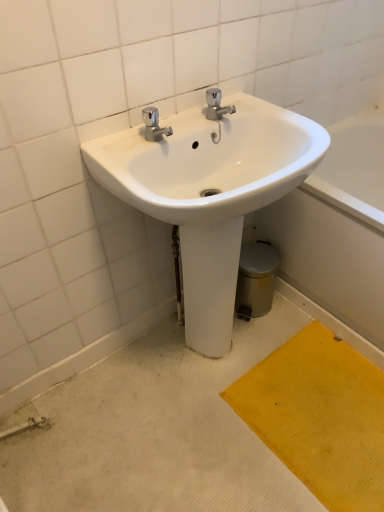
Question: From a real-world perspective, is white glossy sink at center positioned above or below yellow textured mat at lower right?

Choices:
 (A) above
 (B) below

Answer: (A)

Question: From the image's perspective, relative to yellow textured mat at lower right, is white glossy sink at center above or below?

Choices:
 (A) below
 (B) above

Answer: (B)

Question: Which object is positioned closest to the white glossy sink at center?

Choices:
 (A) yellow textured mat at lower right
 (B) white glossy bath at lower right

Answer: (B)

Question: Estimate the real-world distances between objects in this image. Which object is closer to the yellow textured mat at lower right?

Choices:
 (A) white glossy bath at lower right
 (B) white glossy sink at center

Answer: (A)